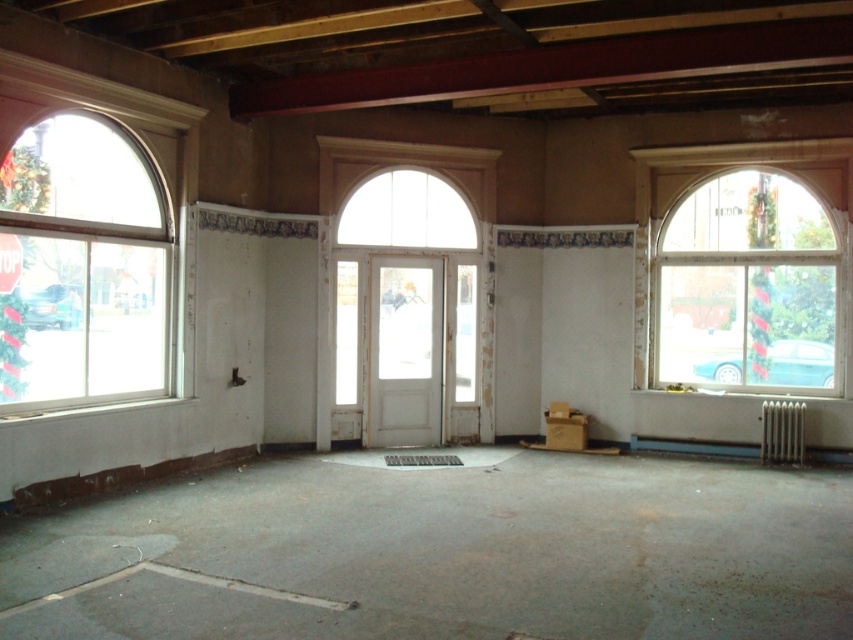
Question: Does white glass window at left come in front of clear glass window at right?

Choices:
 (A) no
 (B) yes

Answer: (B)

Question: Which point is closer to the camera?

Choices:
 (A) clear glass window at right
 (B) white glass window at left

Answer: (B)

Question: Is white glass window at left positioned behind clear glass window at right?

Choices:
 (A) no
 (B) yes

Answer: (A)

Question: Considering the relative positions of white glass window at left and clear glass window at right in the image provided, where is white glass window at left located with respect to clear glass window at right?

Choices:
 (A) left
 (B) right

Answer: (A)

Question: Which point is closer to the camera?

Choices:
 (A) white glass window at left
 (B) clear glass window at right

Answer: (A)

Question: Which of the following is the farthest from the observer?

Choices:
 (A) (76, 234)
 (B) (804, 280)

Answer: (B)